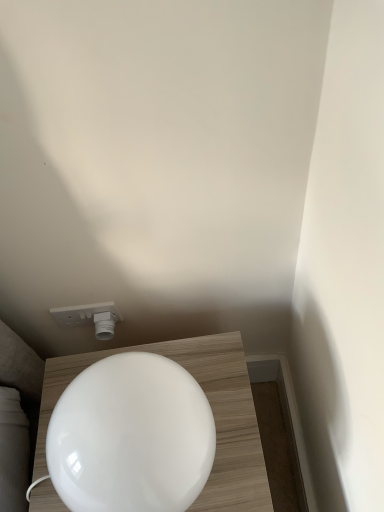
This screenshot has height=512, width=384. Find the location of `white glossy toilet at lower center`. white glossy toilet at lower center is located at coordinates (131, 437).

What do you see at coordinates (131, 437) in the screenshot?
I see `white glossy toilet at lower center` at bounding box center [131, 437].

Describe the element at coordinates (90, 317) in the screenshot. I see `white plastic socket at upper center` at that location.

Measure the distance between white plastic socket at upper center and camera.

They are 95.70 centimeters apart.

You are a GUI agent. You are given a task and a screenshot of the screen. Output one action in this format:
    pyautogui.click(x=<x>, y=<y>)
    Task: Click on the white plastic socket at upper center
    The height and width of the screenshot is (512, 384).
    Given the screenshot: What is the action you would take?
    pyautogui.click(x=90, y=317)

At what (x,y) coordinates should I click in order to perform the action: click on white glossy toilet at lower center. Please return your answer as a coordinate pair (x, y). This screenshot has height=512, width=384. Looking at the image, I should click on (131, 437).

Between white plastic socket at upper center and white glossy toilet at lower center, which one appears on the left side from the viewer's perspective?

From the viewer's perspective, white plastic socket at upper center appears more on the left side.

In the image, is white plastic socket at upper center positioned in front of or behind white glossy toilet at lower center?

Visually, white plastic socket at upper center is located behind white glossy toilet at lower center.

Is point (95, 325) positioned before point (136, 444)?

No, it is behind (136, 444).

From the image's perspective, is white plastic socket at upper center below white glossy toilet at lower center?

Actually, white plastic socket at upper center appears above white glossy toilet at lower center in the image.

Looking at this image, from a real-world perspective, is white plastic socket at upper center on white glossy toilet at lower center?

No, from a real-world perspective, white plastic socket at upper center is not above white glossy toilet at lower center.

Does white plastic socket at upper center have a lesser width compared to white glossy toilet at lower center?

Correct, the width of white plastic socket at upper center is less than that of white glossy toilet at lower center.

Considering the sizes of objects white plastic socket at upper center and white glossy toilet at lower center in the image provided, who is taller, white plastic socket at upper center or white glossy toilet at lower center?

With more height is white glossy toilet at lower center.

Considering the sizes of white plastic socket at upper center and white glossy toilet at lower center in the image, is white plastic socket at upper center bigger or smaller than white glossy toilet at lower center?

Clearly, white plastic socket at upper center is smaller in size than white glossy toilet at lower center.

Is white plastic socket at upper center situated inside white glossy toilet at lower center or outside?

white plastic socket at upper center cannot be found inside white glossy toilet at lower center.

Is the surface of white plastic socket at upper center in direct contact with white glossy toilet at lower center?

No, white plastic socket at upper center is not next to white glossy toilet at lower center.

Is white plastic socket at upper center facing away from white glossy toilet at lower center?

No, white plastic socket at upper center is not facing away from white glossy toilet at lower center.

Where is `toilet below the white plastic socket at upper center (from the image's perspective)`? toilet below the white plastic socket at upper center (from the image's perspective) is located at coordinates (131, 437).

Considering the relative positions of white glossy toilet at lower center and white plastic socket at upper center in the image provided, is white glossy toilet at lower center to the left or to the right of white plastic socket at upper center?

white glossy toilet at lower center is to the right of white plastic socket at upper center.

In the image, is white glossy toilet at lower center positioned in front of or behind white plastic socket at upper center?

white glossy toilet at lower center is in front of white plastic socket at upper center.

Which is in front, point (113, 470) or point (75, 308)?

Positioned in front is point (113, 470).

From the image's perspective, is white glossy toilet at lower center beneath white plastic socket at upper center?

Indeed, from the image's perspective, white glossy toilet at lower center is shown beneath white plastic socket at upper center.

From a real-world perspective, is white glossy toilet at lower center physically above white plastic socket at upper center?

Indeed, from a real-world perspective, white glossy toilet at lower center stands above white plastic socket at upper center.

Does white glossy toilet at lower center have a greater width compared to white plastic socket at upper center?

Yes.

Can you confirm if white glossy toilet at lower center is shorter than white plastic socket at upper center?

No.

Is white glossy toilet at lower center bigger or smaller than white plastic socket at upper center?

In the image, white glossy toilet at lower center appears to be larger than white plastic socket at upper center.

Would you say white glossy toilet at lower center contains white plastic socket at upper center?

No, white glossy toilet at lower center does not contain white plastic socket at upper center.

Is white glossy toilet at lower center not close to white plastic socket at upper center?

No.

Is white glossy toilet at lower center turned away from white plastic socket at upper center?

Yes, white glossy toilet at lower center is facing away from white plastic socket at upper center.

The height and width of the screenshot is (512, 384). What are the coordinates of `light fixture on the left of the white glossy toilet at lower center` in the screenshot? It's located at (90, 317).

Locate an element on the screen. light fixture behind the white glossy toilet at lower center is located at coordinates click(x=90, y=317).

In the image, there is a white glossy toilet at lower center. Where is `light fixture above it (from the image's perspective)`? The height and width of the screenshot is (512, 384). light fixture above it (from the image's perspective) is located at coordinates (90, 317).